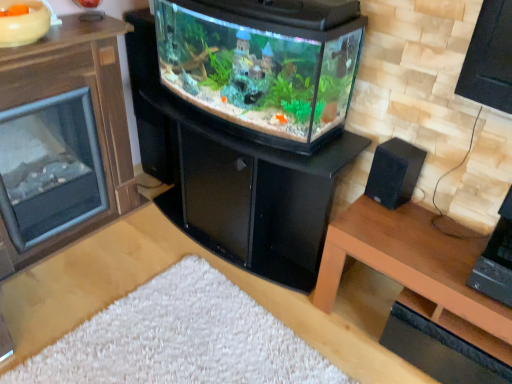
Find the location of a particular element. The width and height of the screenshot is (512, 384). vacant space that is to the left of black glossy fireplace at center is located at coordinates (119, 266).